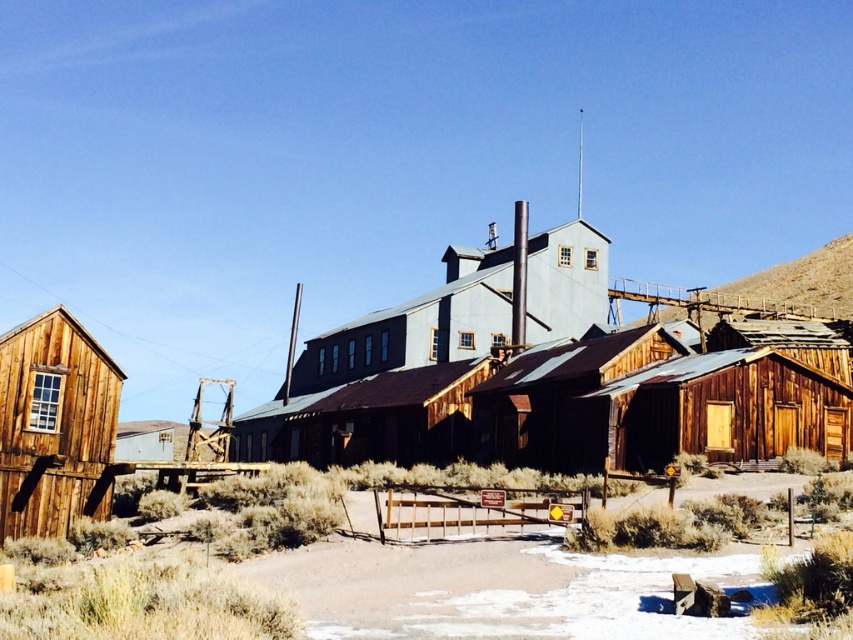
Question: Which point appears closest to the camera in this image?

Choices:
 (A) (607, 381)
 (B) (618, 451)
 (C) (790, 339)

Answer: (B)

Question: Which of these objects is positioned farthest from the wooden hut at center?

Choices:
 (A) brown wooden hut at lower right
 (B) rusty corrugated metal hut at center
 (C) wooden cabin at left

Answer: (C)

Question: Can you confirm if brown wooden hut at lower right is bigger than rusty corrugated metal hut at center?

Choices:
 (A) no
 (B) yes

Answer: (A)

Question: Can you confirm if brown wooden hut at lower right is positioned to the left of rusty corrugated metal hut at center?

Choices:
 (A) no
 (B) yes

Answer: (A)

Question: Is wooden hut at center to the right of brown wooden hut at lower right from the viewer's perspective?

Choices:
 (A) yes
 (B) no

Answer: (A)

Question: Which object is closer to the camera taking this photo?

Choices:
 (A) brown wooden hut at lower right
 (B) wooden hut at center
 (C) wooden cabin at left
 (D) rusty corrugated metal hut at center

Answer: (C)